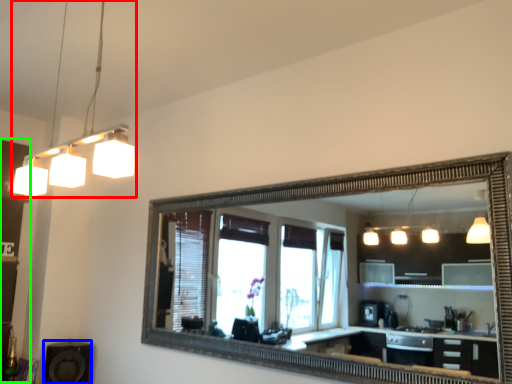
Question: Which object is positioned farthest from light fixture (highlighted by a red box)? Select from speaker (highlighted by a blue box) and dresser (highlighted by a green box).

Choices:
 (A) speaker
 (B) dresser

Answer: (A)